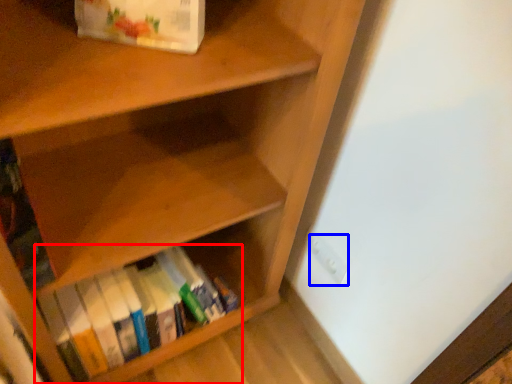
Question: Among these objects, which one is farthest to the camera, book (highlighted by a red box) or electric outlet (highlighted by a blue box)?

Choices:
 (A) book
 (B) electric outlet

Answer: (B)